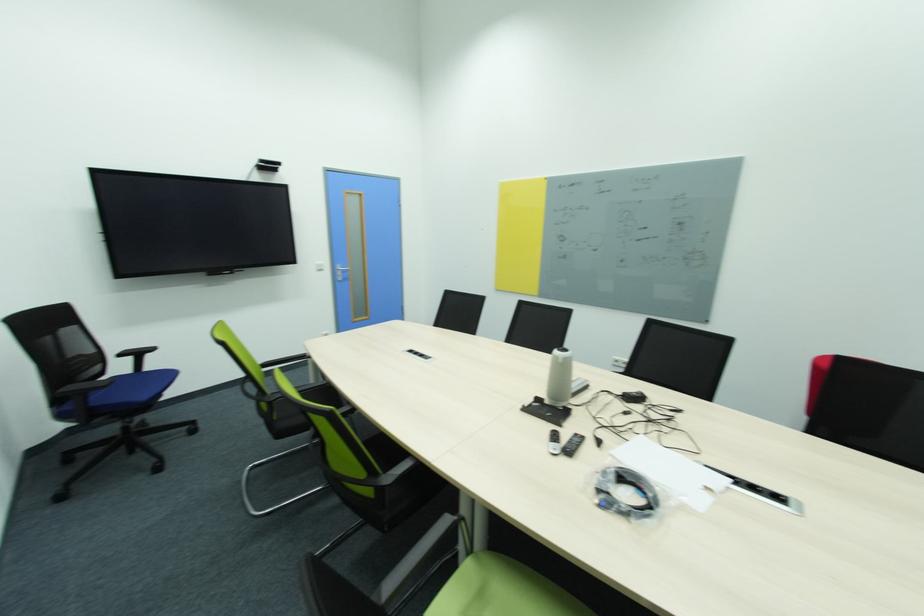
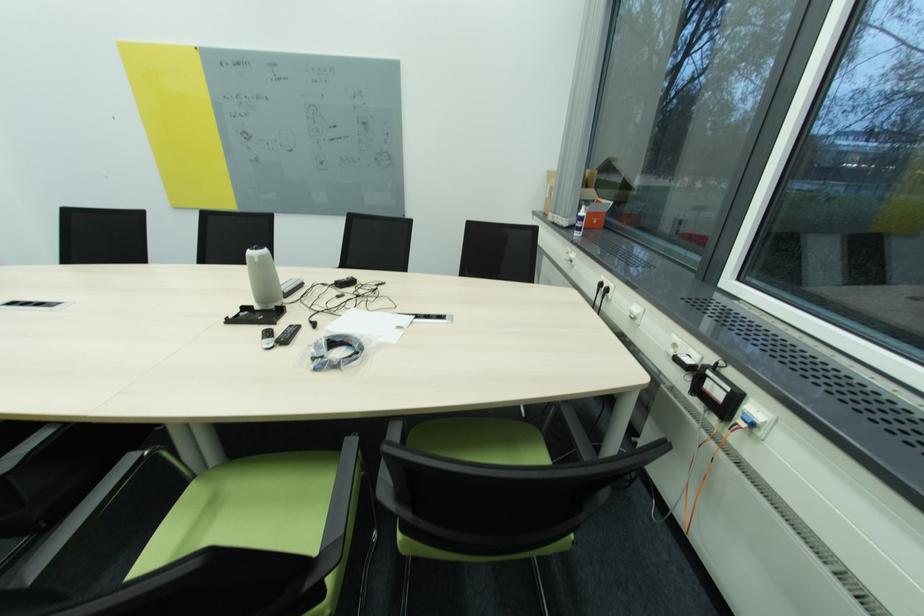
The point at (617, 477) is marked in the first image. Where is the corresponding point in the second image?

(327, 345)